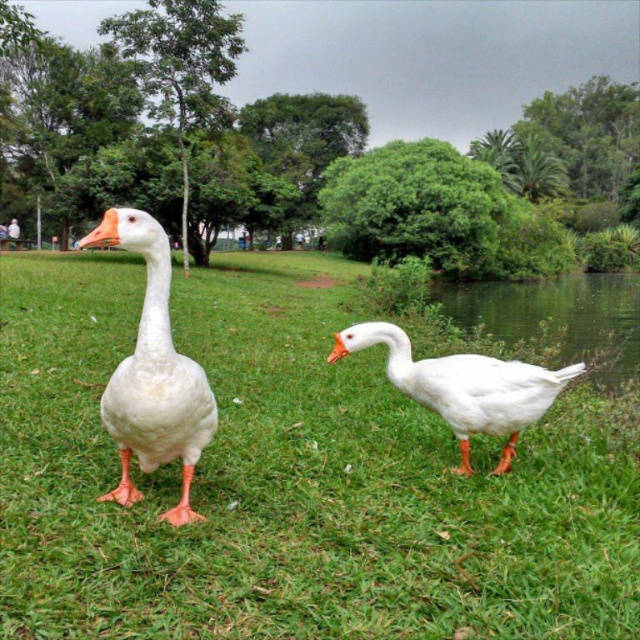
Is point (156, 433) farther from viewer compared to point (561, 308)?

No, it is not.

Is white matte goose at left in front of transparent water at lower center?

Yes, white matte goose at left is in front of transparent water at lower center.

Measure the distance between white matte goose at left and camera.

They are 7.34 feet apart.

At what (x,y) coordinates should I click in order to perform the action: click on white matte goose at left. Please return your answer as a coordinate pair (x, y). The image size is (640, 640). Looking at the image, I should click on (152, 374).

Does white matte grass at center appear on the left side of white matte goose at left?

Indeed, white matte grass at center is positioned on the left side of white matte goose at left.

In the scene shown: Does white matte grass at center appear over white matte goose at left?

Indeed, white matte grass at center is positioned over white matte goose at left.

Who is more distant from viewer, (371,544) or (161,337)?

Point (371,544)

The height and width of the screenshot is (640, 640). Identify the location of white matte grass at center. (289, 481).

Can you confirm if transparent water at lower center is smaller than white matte duck at center?

Incorrect, transparent water at lower center is not smaller in size than white matte duck at center.

Consider the image. Which of these two, transparent water at lower center or white matte duck at center, stands shorter?

With less height is white matte duck at center.

Which is behind, point (620, 374) or point (516, 400)?

The point (620, 374) is more distant.

Identify the location of transparent water at lower center. The width and height of the screenshot is (640, 640). (556, 317).